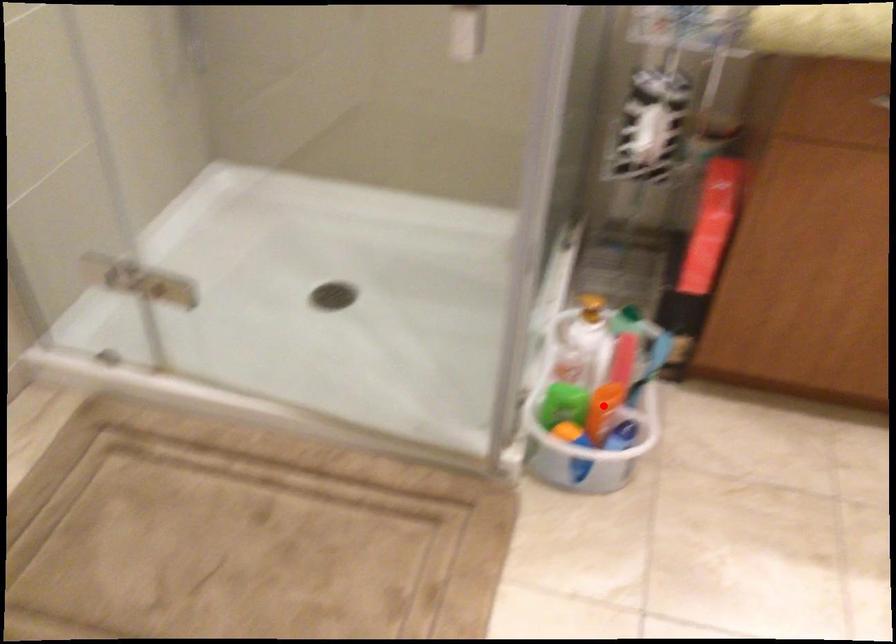
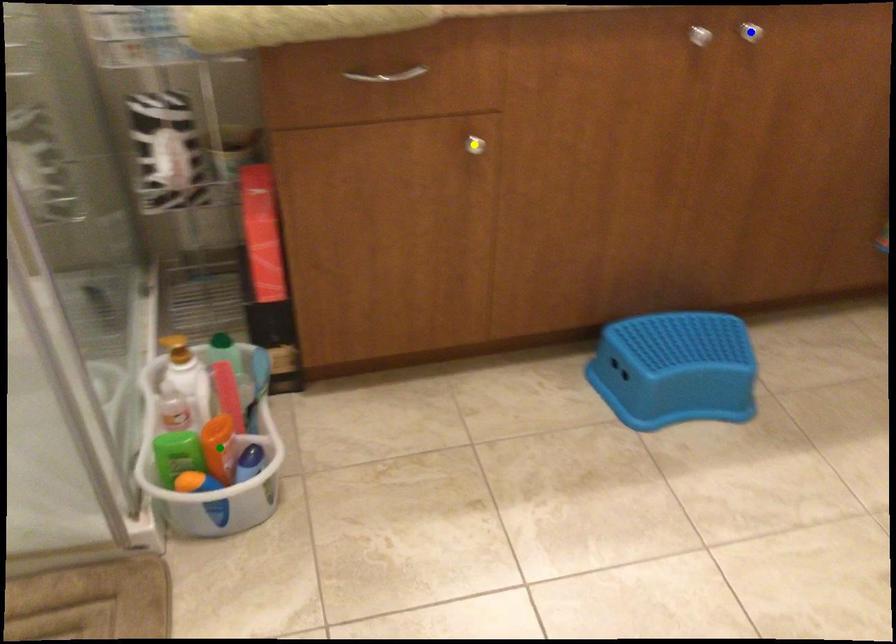
Question: I am providing you with two images of the same scene from different viewpoints. A red point is marked on the first image. You are given multiple points on the second image. Which spot in image 2 lines up with the point in image 1?

Choices:
 (A) green point
 (B) yellow point
 (C) blue point

Answer: (A)